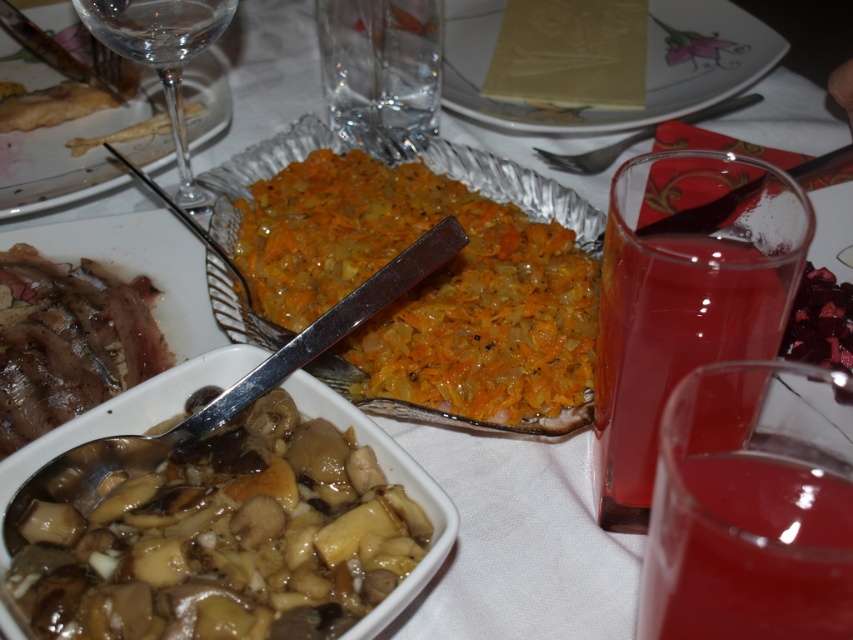
You are a guest at a dinner table and want to reach for the vegetable dish and the mushroom dish. The vegetable dish is located at point [653,83], and the mushroom dish is at point [105,96]. Which dish is closer to you?

The vegetable dish at point [653,83] is closer to you because it is further to the viewer than the mushroom dish at point [105,96].

You are a photographer trying to capture a close detail shot of the vegetable dish on the dining table. The camera is positioned at a certain distance. Can you determine if the point at coordinates point (83, 84) will be in focus if the camera is focused at 22 inches?

The point at coordinates point (83, 84) is 22.63 inches from the camera. Since the camera is focused at 22 inches, the point is slightly beyond the focal distance, so it may not be in perfect focus. Adjust the focus slightly to 22.63 inches for optimal sharpness.